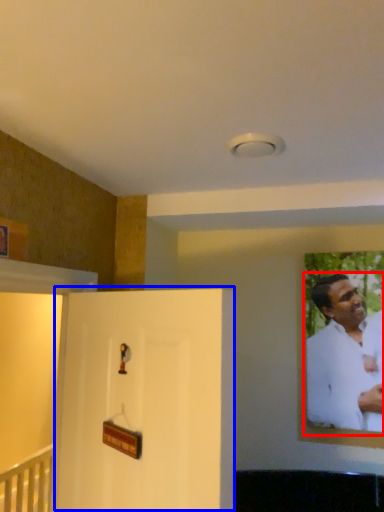
Question: Which object is closer to the camera taking this photo, man (highlighted by a red box) or door (highlighted by a blue box)?

Choices:
 (A) man
 (B) door

Answer: (B)